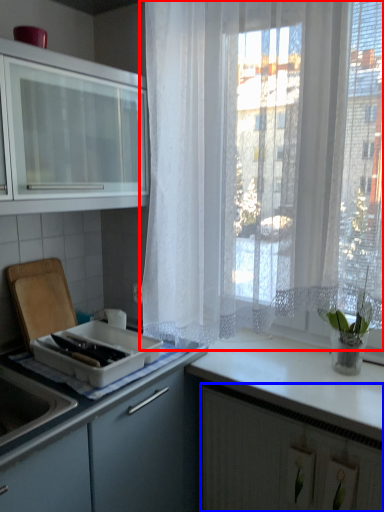
Question: Which object is further to the camera taking this photo, curtain (highlighted by a red box) or cabinetry (highlighted by a blue box)?

Choices:
 (A) curtain
 (B) cabinetry

Answer: (B)